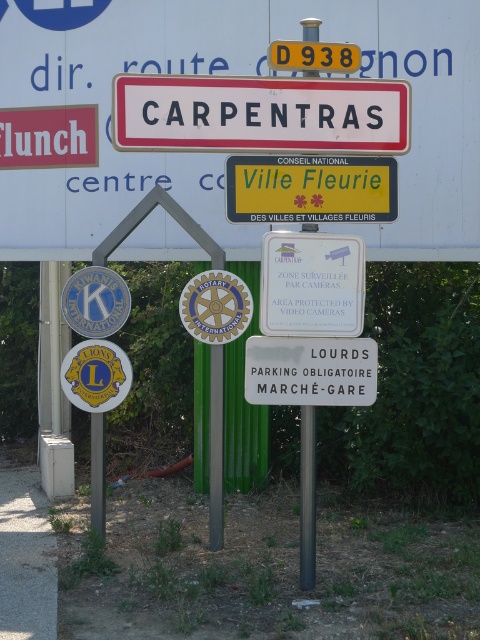
Is white plastic signboard at center to the left of yellowmaterial/texturetraffic sign at center from the viewer's perspective?

Yes, white plastic signboard at center is to the left of yellowmaterial/texturetraffic sign at center.

Where is `white plastic signboard at center`? white plastic signboard at center is located at coordinates (261, 115).

Can you confirm if white plastic signboard at center is positioned to the left of white plastic sign at center?

Indeed, white plastic signboard at center is positioned on the left side of white plastic sign at center.

Looking at this image, between white plastic signboard at center and white plastic sign at center, which one appears on the right side from the viewer's perspective?

From the viewer's perspective, white plastic sign at center appears more on the right side.

Who is more forward, (236,90) or (320,236)?

Point (320,236) is in front.

You are a GUI agent. You are given a task and a screenshot of the screen. Output one action in this format:
    pyautogui.click(x=<x>, y=<y>)
    Task: Click on the white plastic signboard at center
    Image resolution: width=480 pixels, height=640 pixels.
    Given the screenshot: What is the action you would take?
    pyautogui.click(x=261, y=115)

Is yellowmaterial/texturetraffic sign at center behind white plastic sign at center?

Yes, it is.

The image size is (480, 640). What do you see at coordinates (311, 188) in the screenshot? I see `yellowmaterial/texturetraffic sign at center` at bounding box center [311, 188].

What are the coordinates of `yellowmaterial/texturetraffic sign at center` in the screenshot? It's located at (311, 188).